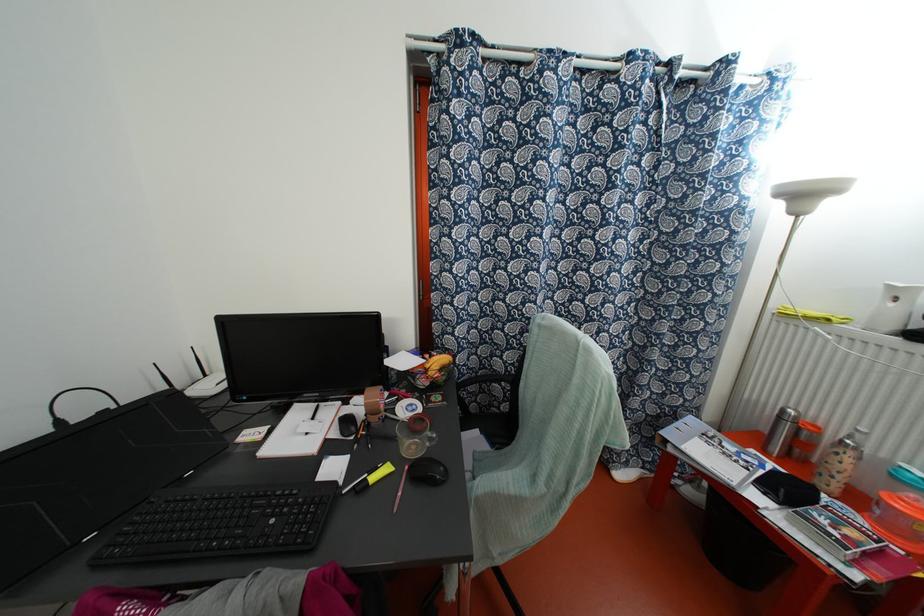
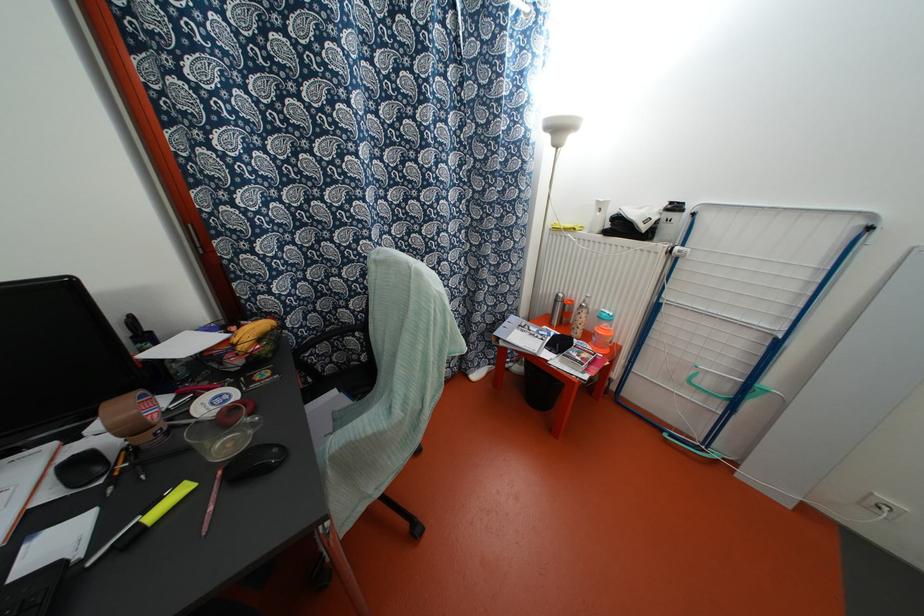
In the second image, find the point that corresponds to (412,447) in the first image.

(228, 444)